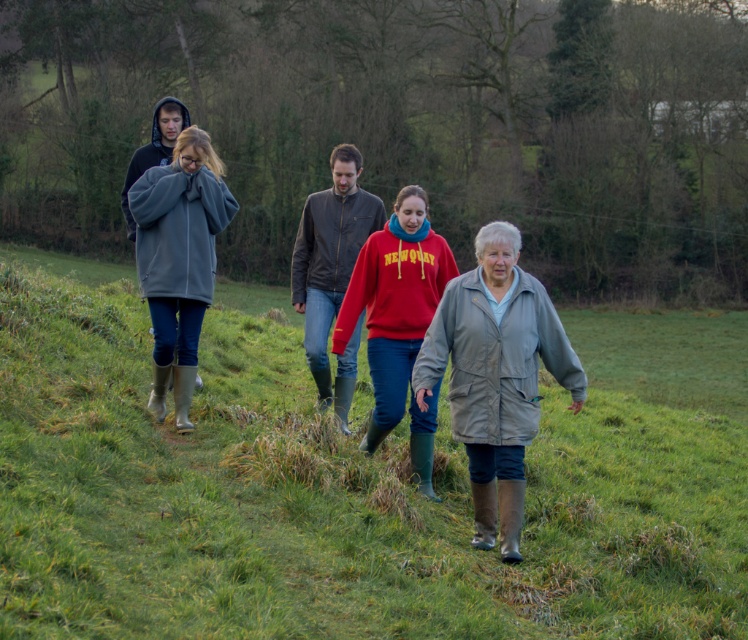
You are a photographer trying to capture a candid shot of the two people in the middle of the group. The gray fleece jacket at center and the matte leather jacket at center are both in your viewfinder. Which jacket should you focus on if you want to include both in the frame without moving the camera? Explain your reasoning.

You should focus on the matte leather jacket at center because the gray fleece jacket at center is to the left of it. By centering the matte leather jacket at center in your viewfinder, you can still capture the gray fleece jacket at center on the left side of the frame without needing to adjust the camera position.

You are a photographer standing 3 meters away from the group. You want to take a photo of the gray fleece jacket at center and the green rubber boots at center. Can you fit both in the frame if your camera has a 1.8 meter field of view?

The green rubber boots at center is 2.12 meters from gray fleece jacket at center. Since the distance between them exceeds the camera field of view of 1.8 meters, you cannot fit both in the frame.

You are standing at point (325, 493) in the image. What object is located exactly at this point?

At point (325, 493) lies green rubber boots at center.